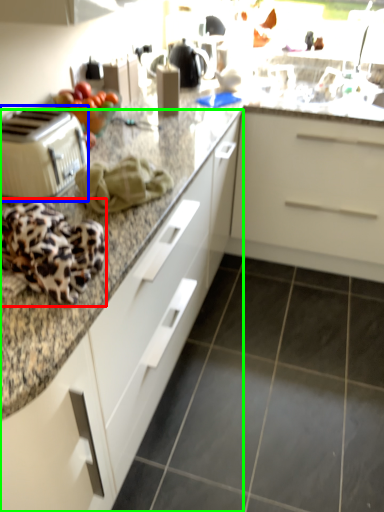
Question: Based on their relative distances, which object is nearer to blanket (highlighted by a red box)? Choose from toaster (highlighted by a blue box) and cabinetry (highlighted by a green box).

Choices:
 (A) toaster
 (B) cabinetry

Answer: (A)